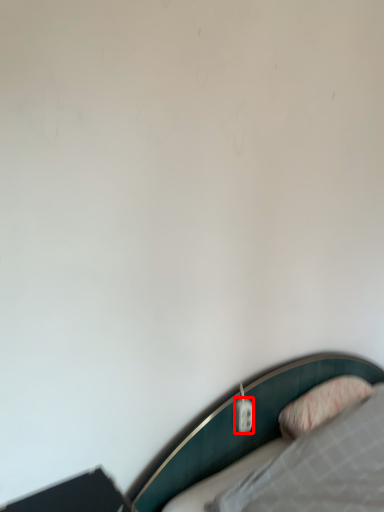
Question: Considering the relative positions of electric outlet (annotated by the red box) and pillow in the image provided, where is electric outlet (annotated by the red box) located with respect to the staircase?

Choices:
 (A) right
 (B) left

Answer: (B)